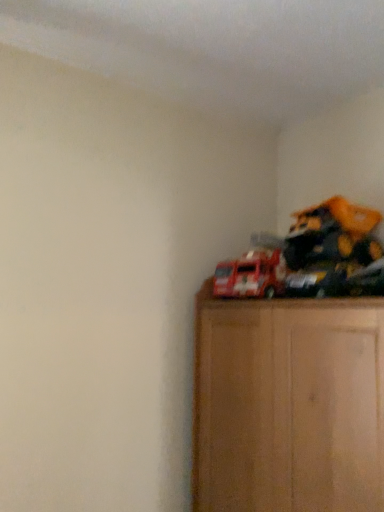
Measure the distance between matte red truck at upper right and camera.

The distance of matte red truck at upper right from camera is 4.57 feet.

Image resolution: width=384 pixels, height=512 pixels. What do you see at coordinates (251, 275) in the screenshot?
I see `matte red truck at upper right` at bounding box center [251, 275].

Locate an element on the screen. matte red truck at upper right is located at coordinates (251, 275).

The image size is (384, 512). What are the coordinates of `matte red truck at upper right` in the screenshot? It's located at (251, 275).